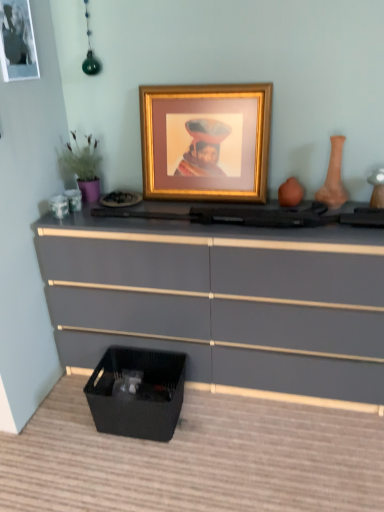
Question: Is gold metallic picture frame at center, acting as the 1th picture frame starting from the right, facing away from terracotta clay vase at right?

Choices:
 (A) no
 (B) yes

Answer: (A)

Question: From a real-world perspective, is gold metallic picture frame at center, acting as the 1th picture frame starting from the right, on top of terracotta clay vase at right?

Choices:
 (A) yes
 (B) no

Answer: (A)

Question: From the image's perspective, is gold metallic picture frame at center, acting as the 1th picture frame starting from the right, on terracotta clay vase at right?

Choices:
 (A) no
 (B) yes

Answer: (B)

Question: Is gold metallic picture frame at center, marked as the 2th picture frame in a left-to-right arrangement, placed right next to terracotta clay vase at right?

Choices:
 (A) no
 (B) yes

Answer: (A)

Question: From the image's perspective, is gold metallic picture frame at center, acting as the 1th picture frame starting from the right, located beneath terracotta clay vase at right?

Choices:
 (A) no
 (B) yes

Answer: (A)

Question: Can you confirm if gold metallic picture frame at center, acting as the 1th picture frame starting from the right, is positioned to the left of terracotta clay vase at right?

Choices:
 (A) yes
 (B) no

Answer: (A)

Question: Can you confirm if metallic gold picture frame at upper left, the 1th picture frame positioned from the left, is thinner than green matte plant at left?

Choices:
 (A) no
 (B) yes

Answer: (B)

Question: Can you confirm if metallic gold picture frame at upper left, which ranks as the 2th picture frame in right-to-left order, is positioned to the left of green matte plant at left?

Choices:
 (A) yes
 (B) no

Answer: (A)

Question: Is metallic gold picture frame at upper left, the 1th picture frame positioned from the left, looking in the opposite direction of green matte plant at left?

Choices:
 (A) yes
 (B) no

Answer: (B)

Question: Would you consider metallic gold picture frame at upper left, the 1th picture frame positioned from the left, to be distant from green matte plant at left?

Choices:
 (A) no
 (B) yes

Answer: (A)

Question: Could you tell me if metallic gold picture frame at upper left, the 1th picture frame positioned from the left, is turned towards green matte plant at left?

Choices:
 (A) yes
 (B) no

Answer: (B)

Question: Is metallic gold picture frame at upper left, which ranks as the 2th picture frame in right-to-left order, closer to the viewer compared to green matte plant at left?

Choices:
 (A) no
 (B) yes

Answer: (B)

Question: Is matte gray chest of drawers at lower center not close to green matte plant at left?

Choices:
 (A) no
 (B) yes

Answer: (A)